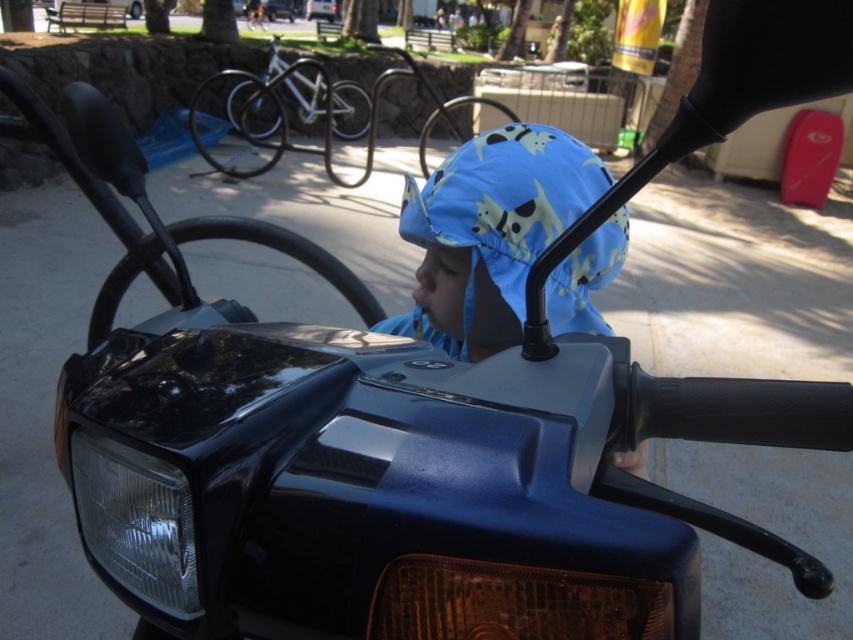
You are a safety inspector checking the visibility of the clear glass headlight at lower left. Considering the blue fabric hat at center is in the line of sight, will the headlight be obscured?

The blue fabric hat at center has a greater height compared to clear glass headlight at lower left, so the headlight could be partially or fully obscured by the hat depending on the angle and positioning.

You are a safety inspector checking the vehicle for proper equipment. The blue fabric hat at center and the clear glass headlight at lower left must both be visible to the driver. Based on their sizes, which one might obstruct the driver view more?

The blue fabric hat at center has a larger width than the clear glass headlight at lower left, so it might obstruct the driver view more.

In the scene shown: You are a safety inspector checking the vehicle for visibility. You notice the blue fabric hat at center and the clear glass headlight at lower left. Which object is bigger in size?

The blue fabric hat at center is larger in size than the clear glass headlight at lower left.